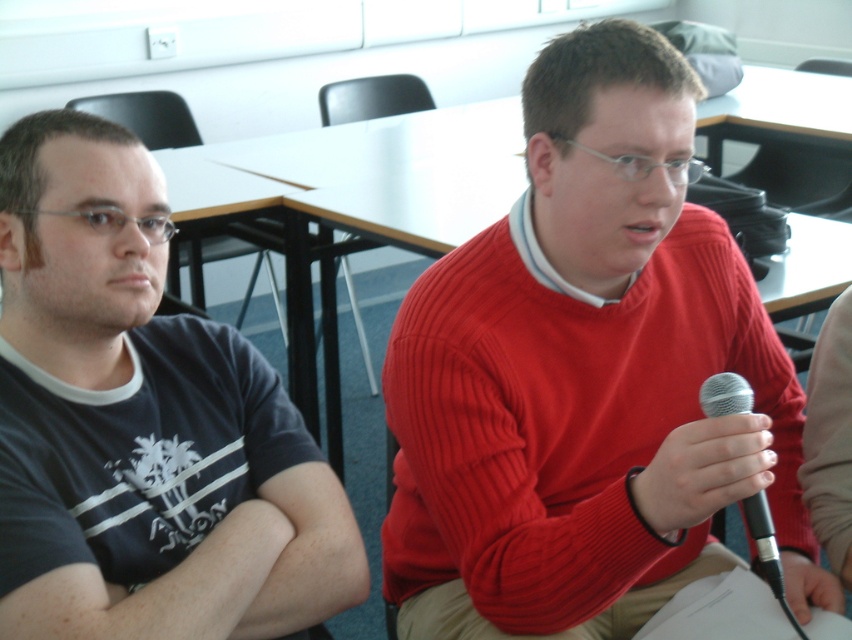
You are organizing a small event and need to place a decorative stand between the red ribbed sweater at center and the silver metallic microphone at center. The stand requires 20 cm of space. Can you determine if there is enough space between them based on their widths?

The red ribbed sweater at center is wider than the silver metallic microphone at center. However, the exact widths are not provided, so it is impossible to determine if there is enough space for the 20 cm stand between them.

You are a photographer standing at the back of the room. You want to take a photo that includes both the red ribbed sweater at center and the silver metallic microphone at center. What is the minimum distance you need to move forward to ensure both objects are in frame?

The red ribbed sweater at center and silver metallic microphone at center are 23.65 centimeters apart from each other. To ensure both are in frame, you need to move forward until the camera can capture a field of view that accommodates at least 23.65 centimeters between them.